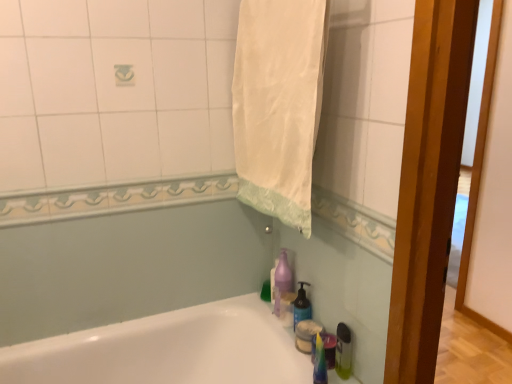
Identify the location of white glossy bathtub at lower left. This screenshot has width=512, height=384. (168, 350).

This screenshot has height=384, width=512. What do you see at coordinates (168, 350) in the screenshot?
I see `white glossy bathtub at lower left` at bounding box center [168, 350].

Identify the location of purple translucent soap dispenser at lower center. This screenshot has width=512, height=384. (282, 281).

What do you see at coordinates (301, 306) in the screenshot? I see `translucent plastic soap dispenser at lower right` at bounding box center [301, 306].

Describe the element at coordinates (343, 351) in the screenshot. I see `translucent plastic bottle at lower right` at that location.

This screenshot has width=512, height=384. In order to click on white glossy bathtub at lower left in this screenshot , I will do `click(168, 350)`.

From the image's perspective, is white glossy bathtub at lower left located beneath white fabric towel at upper center?

Yes.

Does white glossy bathtub at lower left have a smaller size compared to white fabric towel at upper center?

No.

Is white glossy bathtub at lower left in front of or behind white fabric towel at upper center in the image?

white glossy bathtub at lower left is positioned closer to the viewer than white fabric towel at upper center.

Is white fabric towel at upper center far from white glossy bathtub at lower left?

No, white fabric towel at upper center is not far away from white glossy bathtub at lower left.

Considering the relative sizes of white fabric towel at upper center and white glossy bathtub at lower left in the image provided, is white fabric towel at upper center smaller than white glossy bathtub at lower left?

Yes, white fabric towel at upper center is smaller than white glossy bathtub at lower left.

Find the location of a particular element. This screenshot has width=512, height=384. bath towel behind the white glossy bathtub at lower left is located at coordinates (278, 104).

From a real-world perspective, is white fabric towel at upper center located higher than white glossy bathtub at lower left?

Indeed, from a real-world perspective, white fabric towel at upper center stands above white glossy bathtub at lower left.

Can you confirm if purple translucent soap dispenser at lower center is positioned to the right of translucent plastic soap dispenser at lower right?

No.

Is purple translucent soap dispenser at lower center located outside translucent plastic soap dispenser at lower right?

Absolutely, purple translucent soap dispenser at lower center is external to translucent plastic soap dispenser at lower right.

How much distance is there between purple translucent soap dispenser at lower center and translucent plastic soap dispenser at lower right?

purple translucent soap dispenser at lower center is 3.24 inches away from translucent plastic soap dispenser at lower right.

From the image's perspective, is purple translucent soap dispenser at lower center on top of translucent plastic soap dispenser at lower right?

Yes, from the image's perspective, purple translucent soap dispenser at lower center is over translucent plastic soap dispenser at lower right.

From the image's perspective, is white glossy bathtub at lower left under translucent plastic soap dispenser at lower right?

Indeed, from the image's perspective, white glossy bathtub at lower left is shown beneath translucent plastic soap dispenser at lower right.

What's the angular difference between white glossy bathtub at lower left and translucent plastic soap dispenser at lower right's facing directions?

90 degrees separate the facing orientations of white glossy bathtub at lower left and translucent plastic soap dispenser at lower right.

Is white glossy bathtub at lower left in front of or behind translucent plastic soap dispenser at lower right in the image?

white glossy bathtub at lower left is positioned closer to the viewer than translucent plastic soap dispenser at lower right.

Is white glossy bathtub at lower left wider than translucent plastic soap dispenser at lower right?

Yes.

Is white fabric towel at upper center far away from translucent plastic soap dispenser at lower right?

white fabric towel at upper center is near translucent plastic soap dispenser at lower right, not far away.

Considering the positions of point (246, 42) and point (305, 292), is point (246, 42) closer or farther from the camera than point (305, 292)?

Clearly, point (246, 42) is closer to the camera than point (305, 292).

Based on the photo, is white fabric towel at upper center oriented towards translucent plastic soap dispenser at lower right?

No, white fabric towel at upper center is not oriented towards translucent plastic soap dispenser at lower right.

Does white fabric towel at upper center come in front of translucent plastic soap dispenser at lower right?

Yes, the depth of white fabric towel at upper center is less than that of translucent plastic soap dispenser at lower right.

Can you tell me how much white glossy bathtub at lower left and purple translucent soap dispenser at lower center differ in facing direction?

The angular difference between white glossy bathtub at lower left and purple translucent soap dispenser at lower center is 90 degrees.

Does white glossy bathtub at lower left turn towards purple translucent soap dispenser at lower center?

No, white glossy bathtub at lower left is not oriented towards purple translucent soap dispenser at lower center.

Find the location of `bathtub below the purple translucent soap dispenser at lower center (from the image's perspective)`. bathtub below the purple translucent soap dispenser at lower center (from the image's perspective) is located at coordinates (168, 350).

Can you confirm if white glossy bathtub at lower left is thinner than purple translucent soap dispenser at lower center?

No.

Considering the points (347, 361) and (213, 324), which point is behind, point (347, 361) or point (213, 324)?

The point (213, 324) is more distant.

This screenshot has width=512, height=384. I want to click on bottle lying above the white glossy bathtub at lower left (from the image's perspective), so click(343, 351).

Is white glossy bathtub at lower left at the back of translucent plastic bottle at lower right?

No, translucent plastic bottle at lower right's orientation is not away from white glossy bathtub at lower left.

What's the angular difference between translucent plastic bottle at lower right and white glossy bathtub at lower left's facing directions?

There is a 90-degree angle between the facing directions of translucent plastic bottle at lower right and white glossy bathtub at lower left.

The height and width of the screenshot is (384, 512). Identify the location of bathtub on the left of white fabric towel at upper center. click(168, 350).

This screenshot has width=512, height=384. In order to click on bath towel that appears above the white glossy bathtub at lower left (from a real-world perspective) in this screenshot , I will do `click(278, 104)`.

When comparing their distances from white glossy bathtub at lower left, does white fabric towel at upper center or translucent plastic soap dispenser at lower right seem closer?

translucent plastic soap dispenser at lower right.

When comparing their distances from white glossy bathtub at lower left, does white fabric towel at upper center or translucent plastic bottle at lower right seem closer?

translucent plastic bottle at lower right is closer to white glossy bathtub at lower left.

Which object lies further to the anchor point translucent plastic soap dispenser at lower right, white fabric towel at upper center or white glossy bathtub at lower left?

Among the two, white fabric towel at upper center is located further to translucent plastic soap dispenser at lower right.

Which object lies further to the anchor point translucent plastic bottle at lower right, white glossy bathtub at lower left or translucent plastic soap dispenser at lower right?

white glossy bathtub at lower left is further to translucent plastic bottle at lower right.

Based on their spatial positions, is white glossy bathtub at lower left or purple translucent soap dispenser at lower center further from white fabric towel at upper center?

Based on the image, white glossy bathtub at lower left appears to be further to white fabric towel at upper center.

Based on their spatial positions, is white glossy bathtub at lower left or white fabric towel at upper center further from purple translucent soap dispenser at lower center?

The object further to purple translucent soap dispenser at lower center is white fabric towel at upper center.

Looking at the image, which one is located closer to white glossy bathtub at lower left, white fabric towel at upper center or purple translucent soap dispenser at lower center?

Based on the image, purple translucent soap dispenser at lower center appears to be nearer to white glossy bathtub at lower left.

Which object lies further to the anchor point white fabric towel at upper center, translucent plastic bottle at lower right or white glossy bathtub at lower left?

white glossy bathtub at lower left lies further to white fabric towel at upper center than the other object.

Where is `soap dispenser that lies between white fabric towel at upper center and translucent plastic bottle at lower right from top to bottom`? soap dispenser that lies between white fabric towel at upper center and translucent plastic bottle at lower right from top to bottom is located at coordinates point(301,306).

Identify the location of cleaning product between white fabric towel at upper center and translucent plastic soap dispenser at lower right from top to bottom. The width and height of the screenshot is (512, 384). (282, 281).

This screenshot has height=384, width=512. Find the location of `bottle between white fabric towel at upper center and white glossy bathtub at lower left in the vertical direction`. bottle between white fabric towel at upper center and white glossy bathtub at lower left in the vertical direction is located at coordinates (343, 351).

I want to click on cleaning product that lies between white fabric towel at upper center and white glossy bathtub at lower left from top to bottom, so click(x=282, y=281).